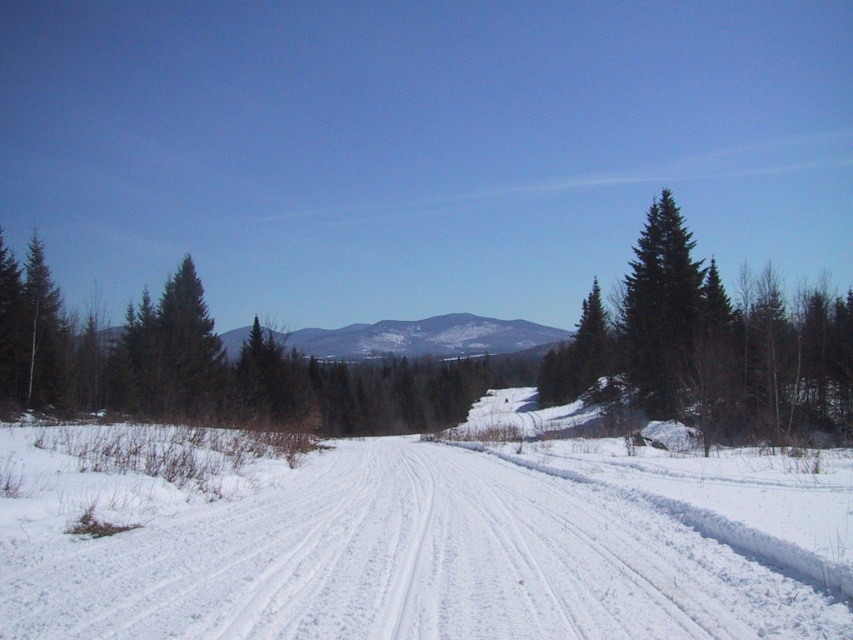
You are a hiker planning to walk along the snow road. You notice the green matte tree at left and the green matte tree at center. Which tree is closer to the road?

The green matte tree at left is positioned under the green matte tree at center, so the green matte tree at left is closer to the road.